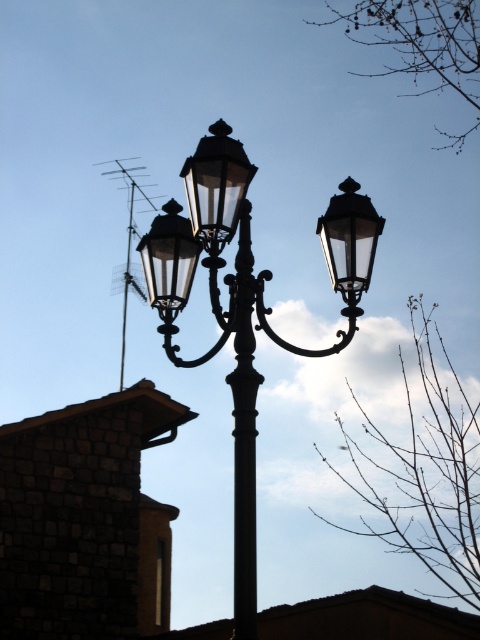
You are a photographer trying to capture the black glass street light at center and the matte glass streetlight at center in a single shot. However, due to the camera settings, you can only focus on one of them clearly. Which one will naturally be in focus if you focus on the one closer to the camera?

The black glass street light at center will naturally be in focus because it is positioned in front of the matte glass streetlight at center, making it closer to the camera.

You are a city planner reviewing a design for a new streetlamp installation. The design includes both a matte black streetlight at center and a matte glass streetlight at center. Based on the provided image, which of these two streetlights would require more space for installation?

The matte black streetlight at center is bigger than the matte glass streetlight at center, so it would require more space for installation.